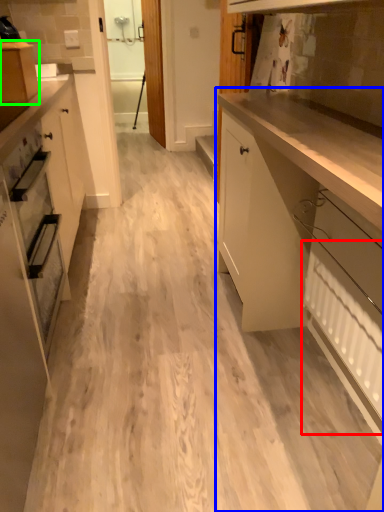
Question: Which object is the farthest from radiator (highlighted by a red box)? Choose among these: cabinetry (highlighted by a blue box) or cabinetry (highlighted by a green box).

Choices:
 (A) cabinetry
 (B) cabinetry

Answer: (B)